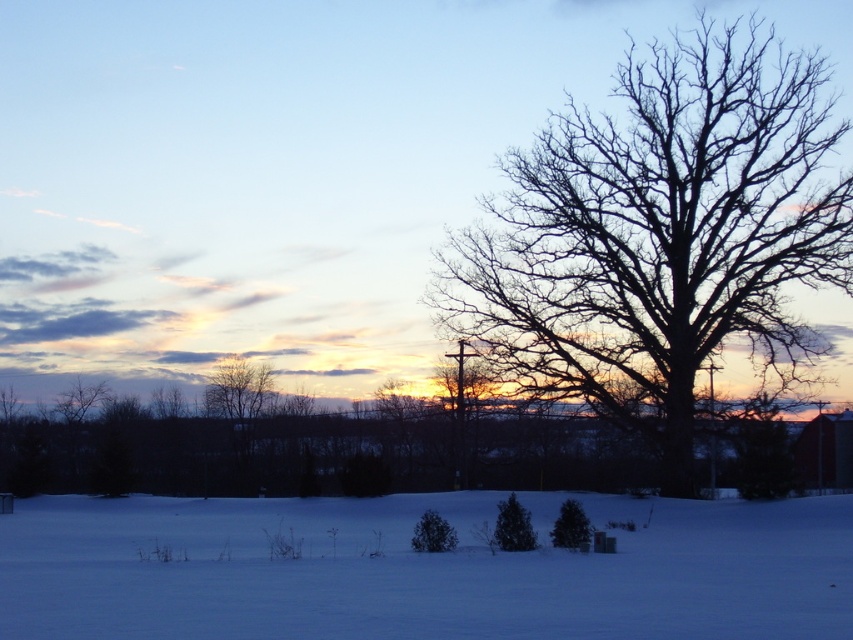
You are an observer standing at the edge of the snowy area. You see the white powdery snow at lower center and the green matte evergreen tree at center. Which object is positioned lower in the image?

The white powdery snow at lower center is positioned lower than the green matte evergreen tree at center in the image.

You are standing at the point closest to the viewer in the winter landscape image. Which point, point (703, 81) or point (498, 502), are you currently at?

You are at point (703, 81) because it is in front of point (498, 502), so it is closer to the viewer.